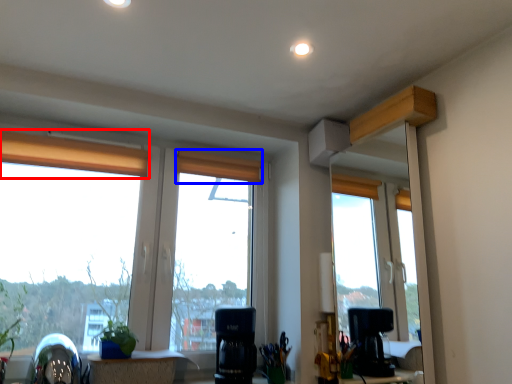
Question: Which of the following is the closest to the observer, curtain (highlighted by a red box) or curtain (highlighted by a blue box)?

Choices:
 (A) curtain
 (B) curtain

Answer: (A)